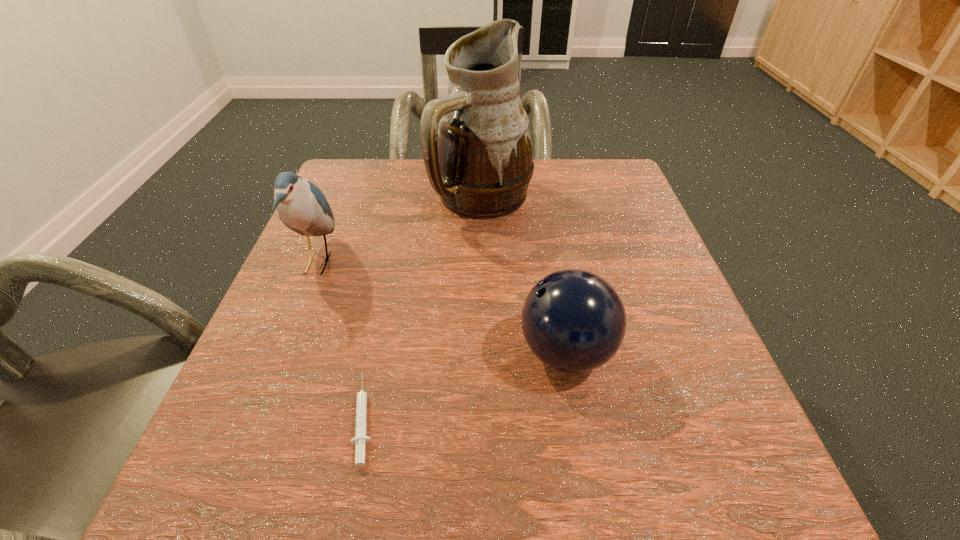
Where is `free area in between the syringe and the second shortest object`? Image resolution: width=960 pixels, height=540 pixels. free area in between the syringe and the second shortest object is located at coordinates (466, 385).

The height and width of the screenshot is (540, 960). I want to click on empty space between the syringe and the second tallest object, so click(x=341, y=340).

The width and height of the screenshot is (960, 540). I want to click on free area in between the second shortest object and the pitcher, so click(x=524, y=275).

Image resolution: width=960 pixels, height=540 pixels. In order to click on free spot between the third object from right to left and the pitcher in this screenshot , I will do `click(423, 308)`.

What are the coordinates of `object that is the third closest to the second farthest object` in the screenshot? It's located at (574, 321).

Find the location of `the second closest object to the second object from left to right`. the second closest object to the second object from left to right is located at coordinates (574, 321).

The height and width of the screenshot is (540, 960). What are the coordinates of `vacant region that satisfies the following two spatial constraints: 1. on the surface of the third tallest object near the finger holes; 2. on the front side of the second object from left to right` in the screenshot? It's located at (578, 418).

Find the location of a particular element. The image size is (960, 540). vacant area that satisfies the following two spatial constraints: 1. from the spout of the tallest object; 2. at the tip of the third nearest object's beak is located at coordinates pos(483,263).

Image resolution: width=960 pixels, height=540 pixels. I want to click on vacant area in the image that satisfies the following two spatial constraints: 1. at the tip of the third nearest object's beak; 2. on the left side of the syringe, so (x=254, y=418).

The image size is (960, 540). In order to click on vacant space that satisfies the following two spatial constraints: 1. at the tip of the second object from left to right's beak; 2. on the right side of the bird in this screenshot , I will do (254, 418).